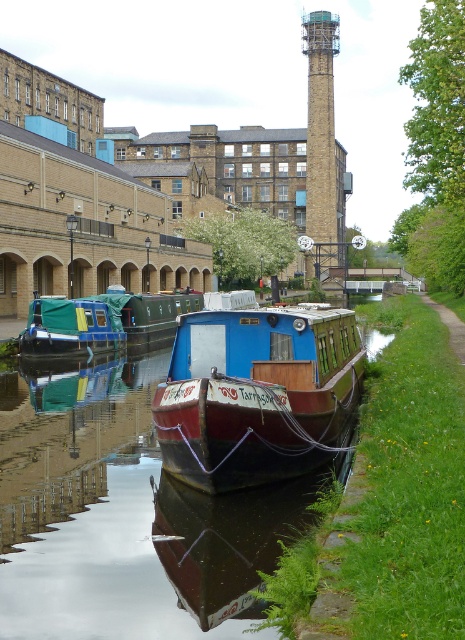
You are standing at the edge of the canal and want to locate the smooth dark water at center. According to the coordinates provided, in which direction should you look relative to your position?

The smooth dark water at center is located at coordinates point (123, 518). Since the coordinate system is not specified, it is recommended to refer to the image for the exact location.

You are standing at the edge of the canal and want to reach a specific point marked at coordinates (x=30, y=337). Given that your maximum reach is 30 meters, will you be able to touch that point without moving closer?

The point at coordinates (x=30, y=337) is 31.99 meters away from the viewer, which exceeds your maximum reach of 30 meters. Therefore, you cannot touch it without moving closer.